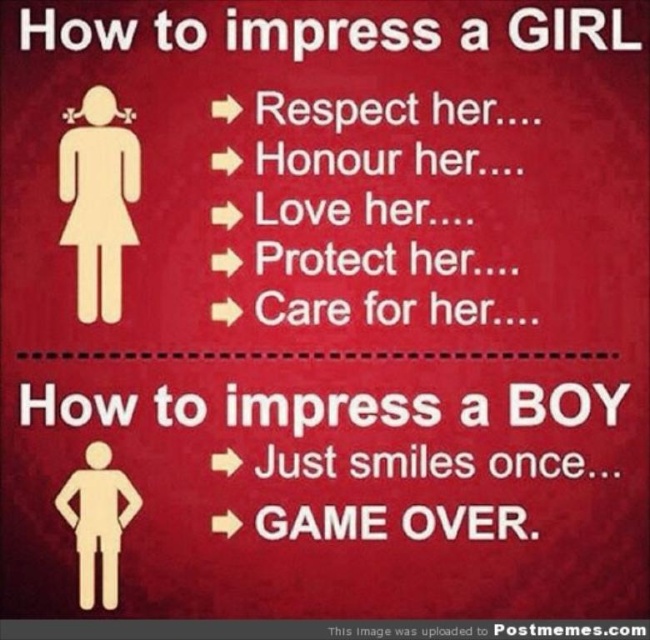
Can you confirm if wooden figure at upper left is thinner than white paper man at center?

Yes, wooden figure at upper left is thinner than white paper man at center.

Who is more distant from viewer, [140,161] or [110,600]?

Point [110,600]

You are a GUI agent. You are given a task and a screenshot of the screen. Output one action in this format:
    pyautogui.click(x=<x>, y=<y>)
    Task: Click on the wooden figure at upper left
    
    Given the screenshot: What is the action you would take?
    pyautogui.click(x=98, y=198)